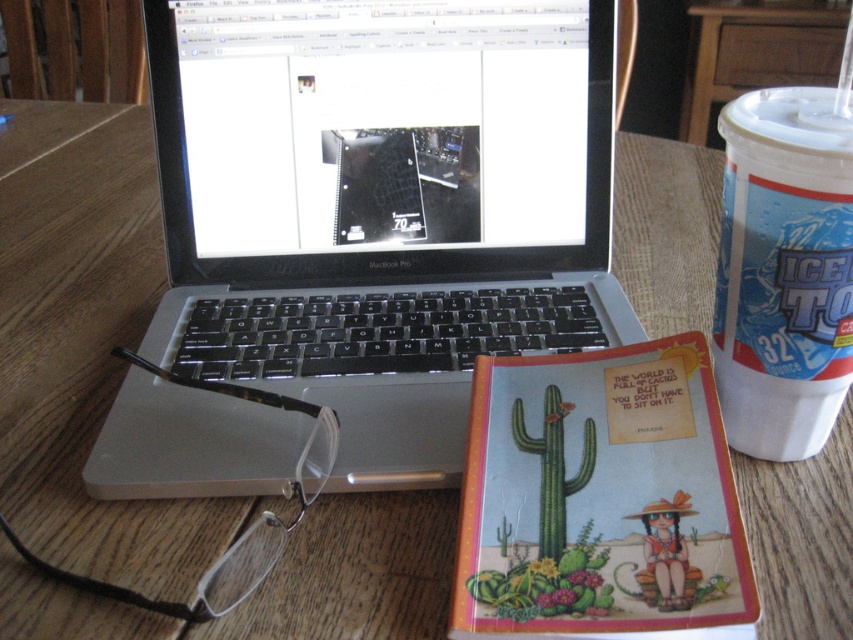
Question: Based on their relative distances, which object is farther from the green matte cactus at center?

Choices:
 (A) silver/black plastic laptop at center
 (B) white paper cup at right

Answer: (A)

Question: Is silver/black plastic laptop at center above green matte cactus at center?

Choices:
 (A) yes
 (B) no

Answer: (A)

Question: Which object appears farthest from the camera in this image?

Choices:
 (A) green matte cactus at center
 (B) silver/black plastic laptop at center
 (C) white paper cup at right

Answer: (B)

Question: Is white paper cup at right above green matte cactus at center?

Choices:
 (A) no
 (B) yes

Answer: (B)

Question: Is silver/black plastic laptop at center positioned at the back of green matte cactus at center?

Choices:
 (A) yes
 (B) no

Answer: (A)

Question: Which point appears closest to the camera in this image?

Choices:
 (A) (241, 131)
 (B) (556, 404)
 (C) (770, 92)

Answer: (B)